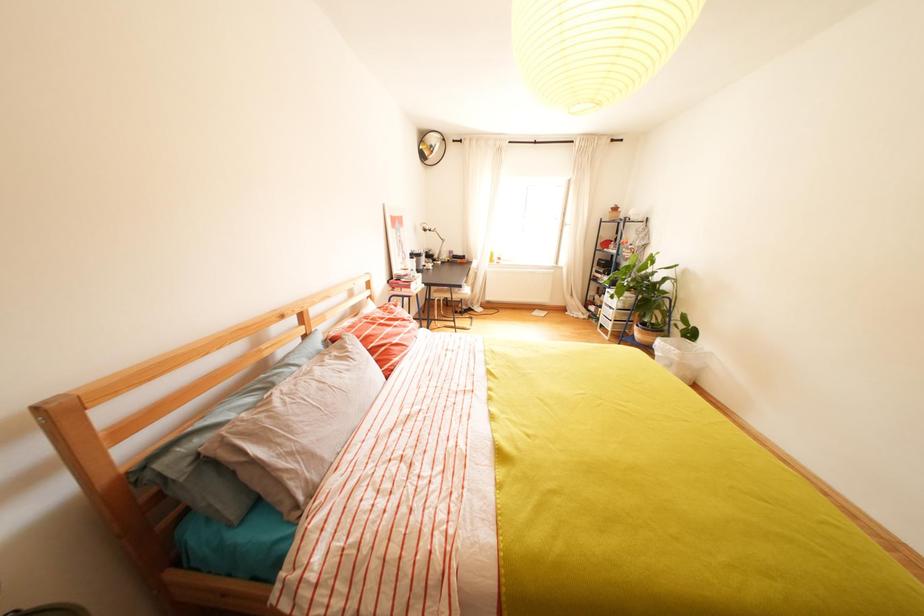
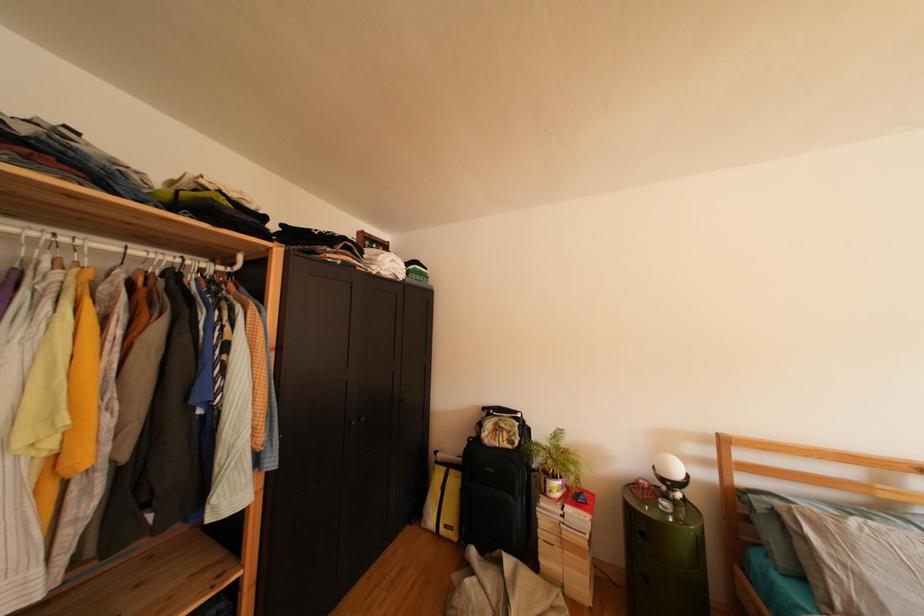
Question: How did the camera likely rotate?

Choices:
 (A) Left
 (B) Right
 (C) Up
 (D) Down

Answer: (A)